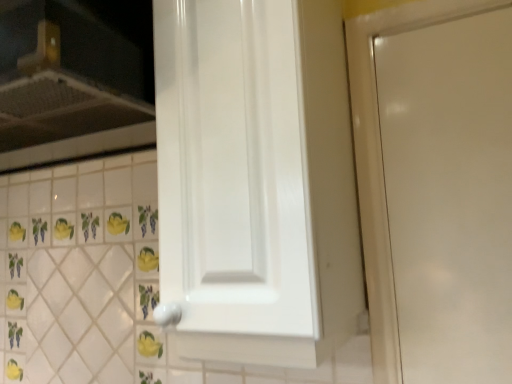
Question: Is white glossy cabinet door at center situated inside white glossy vent at upper left or outside?

Choices:
 (A) inside
 (B) outside

Answer: (B)

Question: From a real-world perspective, is white glossy cabinet door at center physically located above or below white glossy vent at upper left?

Choices:
 (A) above
 (B) below

Answer: (B)

Question: Looking at the image, does white glossy cabinet door at center seem bigger or smaller compared to white glossy vent at upper left?

Choices:
 (A) big
 (B) small

Answer: (B)

Question: Is white glossy vent at upper left spatially inside white glossy cabinet door at center, or outside of it?

Choices:
 (A) outside
 (B) inside

Answer: (A)

Question: Does point (148, 51) appear closer or farther from the camera than point (202, 140)?

Choices:
 (A) closer
 (B) farther

Answer: (B)

Question: In terms of width, does white glossy vent at upper left look wider or thinner when compared to white glossy cabinet door at center?

Choices:
 (A) thin
 (B) wide

Answer: (B)

Question: From a real-world perspective, is white glossy vent at upper left above or below white glossy cabinet door at center?

Choices:
 (A) below
 (B) above

Answer: (B)